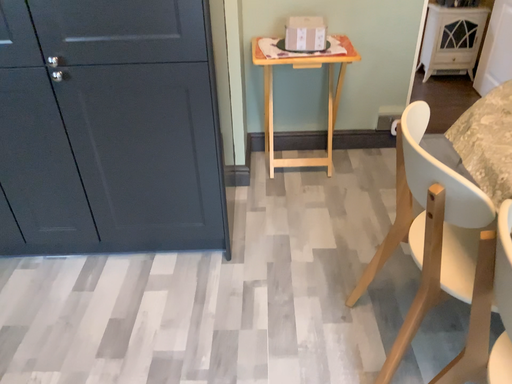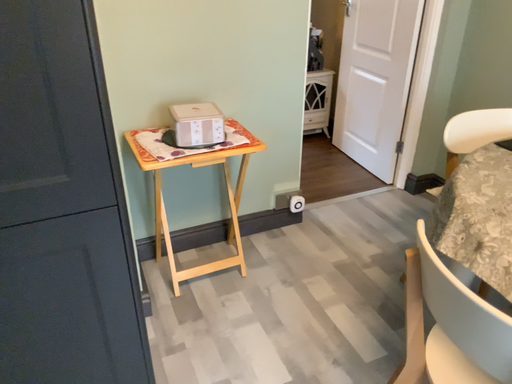
Question: How did the camera likely rotate when shooting the video?

Choices:
 (A) rotated left
 (B) rotated right

Answer: (B)